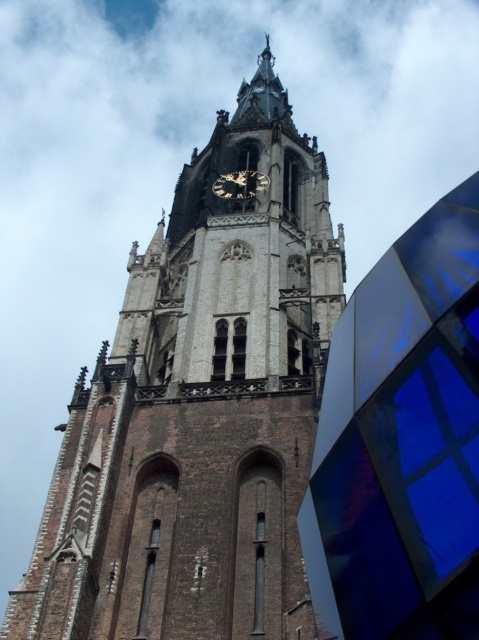
Question: Can you confirm if brown brick tower at center is positioned above metallic clock face at center?

Choices:
 (A) yes
 (B) no

Answer: (A)

Question: Is the position of brown brick tower at center less distant than that of metallic clock face at center?

Choices:
 (A) no
 (B) yes

Answer: (B)

Question: Does brown brick tower at center appear on the right side of metallic clock face at center?

Choices:
 (A) no
 (B) yes

Answer: (B)

Question: Which point appears closest to the camera in this image?

Choices:
 (A) (251, 182)
 (B) (59, 468)

Answer: (B)

Question: Which point is closer to the camera taking this photo?

Choices:
 (A) (266, 182)
 (B) (211, 609)

Answer: (B)